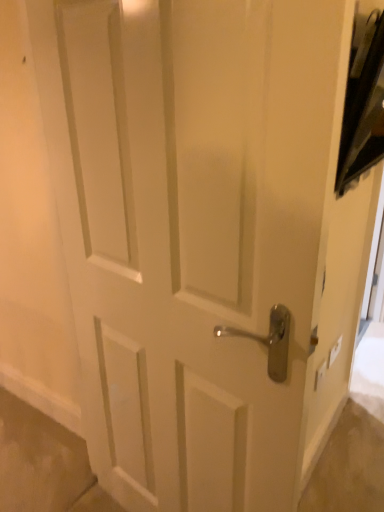
Question: Is point (339, 348) closer or farther from the camera than point (324, 369)?

Choices:
 (A) farther
 (B) closer

Answer: (A)

Question: From their relative heights in the image, would you say white plastic light switch at upper right, which appears as the 2th light switch when viewed from the left, is taller or shorter than white plastic light switch at lower right, which is counted as the first light switch, starting from the left?

Choices:
 (A) tall
 (B) short

Answer: (B)

Question: In terms of size, does white plastic light switch at upper right, which appears as the 2th light switch when viewed from the left, appear bigger or smaller than white plastic light switch at lower right, which is counted as the first light switch, starting from the left?

Choices:
 (A) big
 (B) small

Answer: (A)

Question: In terms of width, does white plastic light switch at lower right, the first light switch when ordered from front to back, look wider or thinner when compared to white plastic light switch at upper right, which appears as the 2th light switch when viewed from the left?

Choices:
 (A) thin
 (B) wide

Answer: (A)

Question: Is white plastic light switch at lower right, arranged as the second light switch when viewed from the back, situated inside white plastic light switch at upper right, the 2th light switch in the front-to-back sequence, or outside?

Choices:
 (A) outside
 (B) inside

Answer: (A)

Question: Looking at the image, does white plastic light switch at lower right, the first light switch when ordered from front to back, seem bigger or smaller compared to white plastic light switch at upper right, the 2th light switch in the front-to-back sequence?

Choices:
 (A) big
 (B) small

Answer: (B)

Question: Would you say white plastic light switch at lower right, which is counted as the 2th light switch, starting from the right, is to the left or to the right of white plastic light switch at upper right, positioned as the 1th light switch in right-to-left order, in the picture?

Choices:
 (A) right
 (B) left

Answer: (B)